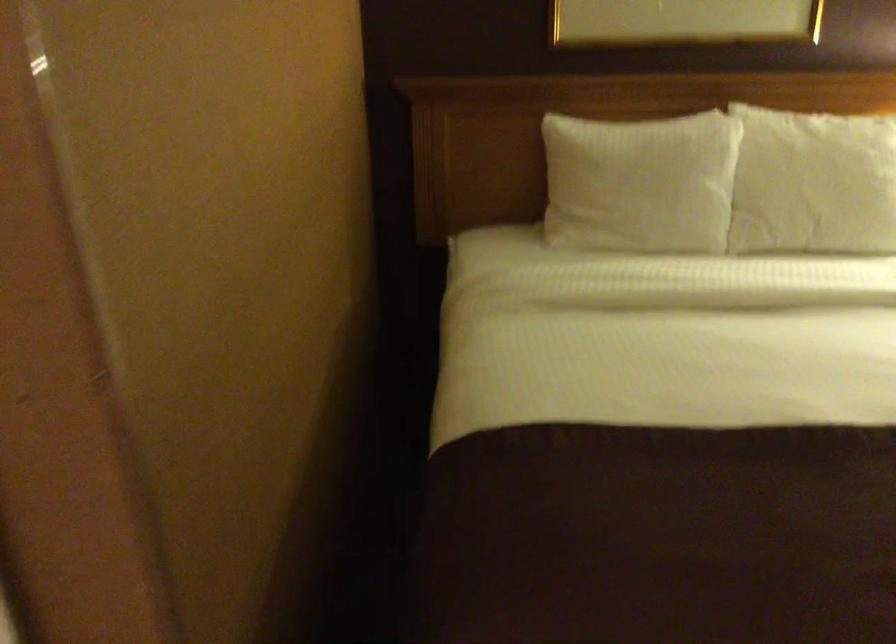
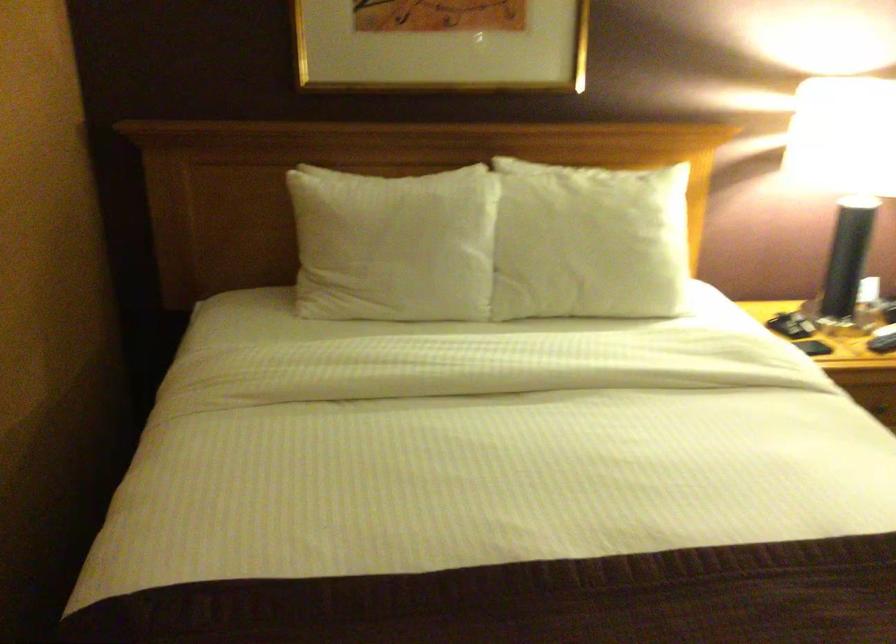
Which direction would the cameraman need to move to produce the second image?

The cameraman walked toward right, forward.